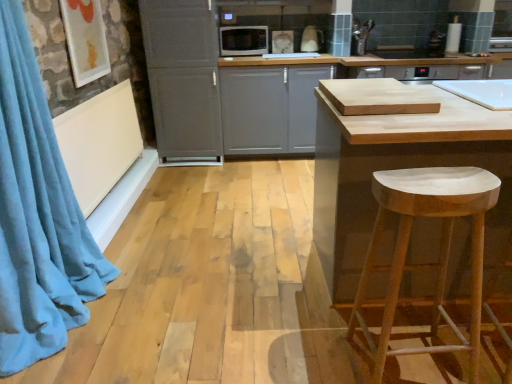
The height and width of the screenshot is (384, 512). In order to click on vacant area that is in front of white matte cabinet at center, which is counted as the second cabinetry, starting from the left in this screenshot , I will do `click(264, 177)`.